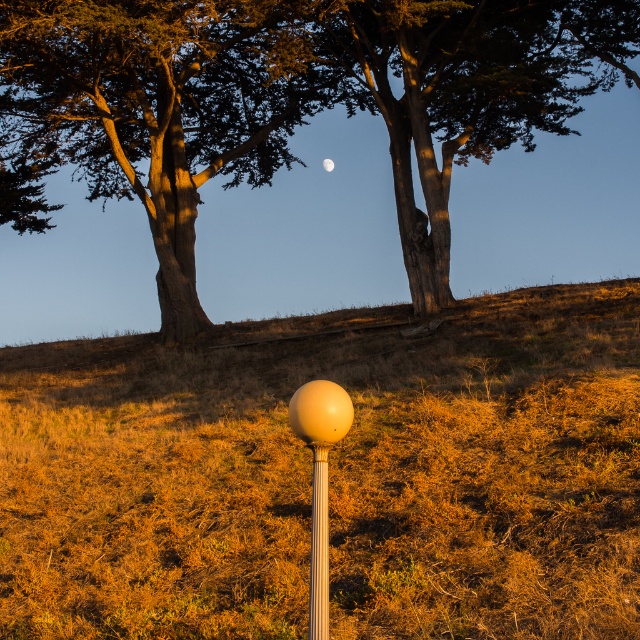
You are designing a garden layout and need to place a decorative stone between the matte yellow grass at center and the metallic silver pole at center. Based on their sizes, which object should the stone be closer to to ensure it doesn

The matte yellow grass at center has a larger width than the metallic silver pole at center. Therefore, the decorative stone should be placed closer to the metallic silver pole at center to balance the layout.

Consider the image. You are an astronomer observing the night sky and notice the smooth brown tree trunk at upper center and the white matte moon at upper center in your view. Which object is closer to your line of sight?

The smooth brown tree trunk at upper center is closer to your line of sight because it is positioned in front of the white matte moon at upper center.